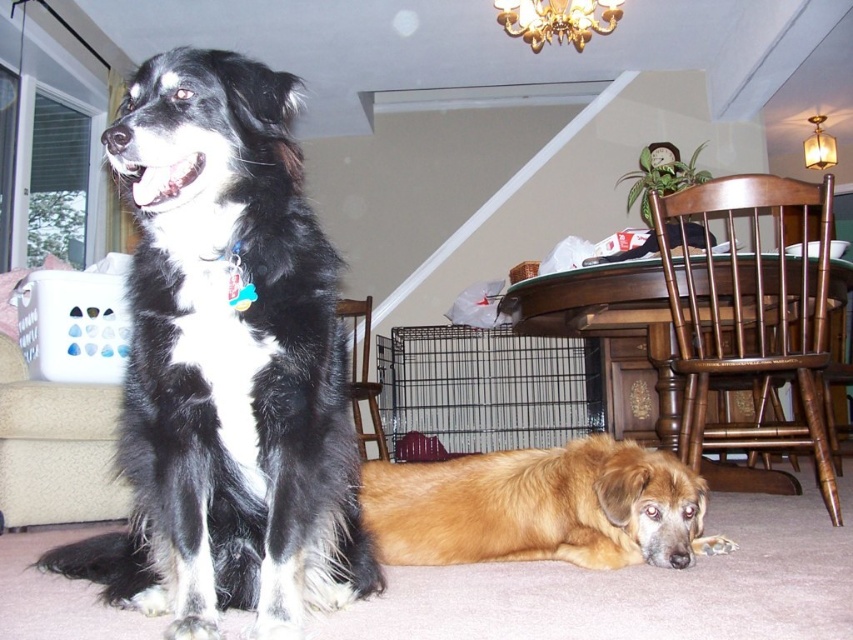
Is golden fur dog at lower center thinner than black wire cage at lower center?

Yes, golden fur dog at lower center is thinner than black wire cage at lower center.

This screenshot has height=640, width=853. Find the location of `golden fur dog at lower center`. golden fur dog at lower center is located at coordinates (x=540, y=508).

Is point (157, 596) farther from viewer compared to point (521, 413)?

No, (157, 596) is closer to viewer.

Can you confirm if black fur dog at left is positioned to the left of black wire cage at lower center?

Correct, you'll find black fur dog at left to the left of black wire cage at lower center.

Between point (229, 369) and point (570, 362), which one is positioned behind?

Point (570, 362)

Image resolution: width=853 pixels, height=640 pixels. Identify the location of black fur dog at left. (227, 365).

Who is more distant from viewer, (210, 365) or (583, 500)?

The point (583, 500) is behind.

Who is higher up, black fur dog at left or golden fur dog at lower center?

black fur dog at left

Where is `black fur dog at left`? Image resolution: width=853 pixels, height=640 pixels. black fur dog at left is located at coordinates pyautogui.click(x=227, y=365).

Where is `black fur dog at left`? This screenshot has width=853, height=640. black fur dog at left is located at coordinates (227, 365).